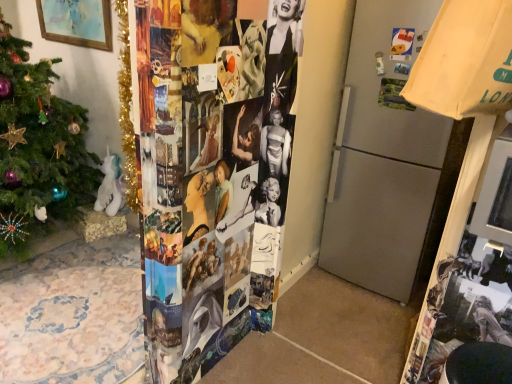
What is the approximate width of gold tinsel christmas tree at left?

gold tinsel christmas tree at left is 3.56 inches wide.

Find the location of a particular element. Image resolution: width=512 pixels, height=384 pixels. gold tinsel christmas tree at left is located at coordinates pos(127,111).

Describe the element at coordinates (127, 111) in the screenshot. Image resolution: width=512 pixels, height=384 pixels. I see `gold tinsel christmas tree at left` at that location.

Describe the element at coordinates (76, 22) in the screenshot. I see `wooden framed painting at upper left` at that location.

The image size is (512, 384). I want to click on wooden framed painting at upper left, so click(76, 22).

Find the location of a particular element. This screenshot has width=512, height=384. gold tinsel christmas tree at left is located at coordinates (127, 111).

Considering the positions of objects wooden framed painting at upper left and gold tinsel christmas tree at left in the image provided, who is more to the right, wooden framed painting at upper left or gold tinsel christmas tree at left?

gold tinsel christmas tree at left.

Relative to gold tinsel christmas tree at left, is wooden framed painting at upper left in front or behind?

In the image, wooden framed painting at upper left appears behind gold tinsel christmas tree at left.

Does point (46, 33) come in front of point (135, 196)?

No, (46, 33) is behind (135, 196).

From the picture: From the image's perspective, does wooden framed painting at upper left appear lower than gold tinsel christmas tree at left?

Incorrect, from the image's perspective, wooden framed painting at upper left is higher than gold tinsel christmas tree at left.

From a real-world perspective, between wooden framed painting at upper left and gold tinsel christmas tree at left, who is vertically higher?

In real-world perspective, wooden framed painting at upper left is above.

Based on the photo, is wooden framed painting at upper left thinner than gold tinsel christmas tree at left?

Yes.

From their relative heights in the image, would you say wooden framed painting at upper left is taller or shorter than gold tinsel christmas tree at left?

In the image, wooden framed painting at upper left appears to be shorter than gold tinsel christmas tree at left.

Considering the sizes of objects wooden framed painting at upper left and gold tinsel christmas tree at left in the image provided, who is smaller, wooden framed painting at upper left or gold tinsel christmas tree at left?

gold tinsel christmas tree at left.

Would you say wooden framed painting at upper left is outside gold tinsel christmas tree at left?

Absolutely, wooden framed painting at upper left is external to gold tinsel christmas tree at left.

Is wooden framed painting at upper left next to gold tinsel christmas tree at left?

No, wooden framed painting at upper left is not with gold tinsel christmas tree at left.

Does wooden framed painting at upper left turn towards gold tinsel christmas tree at left?

No, wooden framed painting at upper left does not turn towards gold tinsel christmas tree at left.

How different are the orientations of wooden framed painting at upper left and gold tinsel christmas tree at left in degrees?

2.12 degrees.

You are a GUI agent. You are given a task and a screenshot of the screen. Output one action in this format:
    pyautogui.click(x=<x>, y=<y>)
    Task: Click on the christmas tree below the wooden framed painting at upper left (from a real-world perspective)
    The height and width of the screenshot is (384, 512).
    Given the screenshot: What is the action you would take?
    pyautogui.click(x=127, y=111)

Visually, is gold tinsel christmas tree at left positioned to the left or to the right of wooden framed painting at upper left?

gold tinsel christmas tree at left is positioned on wooden framed painting at upper left's right side.

Which object is closer to the camera taking this photo, gold tinsel christmas tree at left or wooden framed painting at upper left?

Positioned in front is gold tinsel christmas tree at left.

Is point (128, 13) positioned after point (94, 29)?

No, (128, 13) is in front of (94, 29).

From the image's perspective, is gold tinsel christmas tree at left on top of wooden framed painting at upper left?

Incorrect, from the image's perspective, gold tinsel christmas tree at left is lower than wooden framed painting at upper left.

From a real-world perspective, is gold tinsel christmas tree at left beneath wooden framed painting at upper left?

Correct, in the physical world, gold tinsel christmas tree at left is lower than wooden framed painting at upper left.

Is gold tinsel christmas tree at left thinner than wooden framed painting at upper left?

No.

Considering the relative sizes of gold tinsel christmas tree at left and wooden framed painting at upper left in the image provided, is gold tinsel christmas tree at left shorter than wooden framed painting at upper left?

In fact, gold tinsel christmas tree at left may be taller than wooden framed painting at upper left.

Does gold tinsel christmas tree at left have a smaller size compared to wooden framed painting at upper left?

Yes.

Is gold tinsel christmas tree at left outside of wooden framed painting at upper left?

Yes, gold tinsel christmas tree at left is located beyond the bounds of wooden framed painting at upper left.

Can you see gold tinsel christmas tree at left touching wooden framed painting at upper left?

There is a gap between gold tinsel christmas tree at left and wooden framed painting at upper left.

Is gold tinsel christmas tree at left aimed at wooden framed painting at upper left?

No, gold tinsel christmas tree at left is not facing towards wooden framed painting at upper left.

Can you tell me how much gold tinsel christmas tree at left and wooden framed painting at upper left differ in facing direction?

The facing directions of gold tinsel christmas tree at left and wooden framed painting at upper left are 2.12 degrees apart.

Image resolution: width=512 pixels, height=384 pixels. Find the location of `christmas tree below the wooden framed painting at upper left (from the image's perspective)`. christmas tree below the wooden framed painting at upper left (from the image's perspective) is located at coordinates (127, 111).

The width and height of the screenshot is (512, 384). What are the coordinates of `christmas tree that appears on the right of wooden framed painting at upper left` in the screenshot? It's located at (127, 111).

Identify the location of christmas tree in front of the wooden framed painting at upper left. (127, 111).